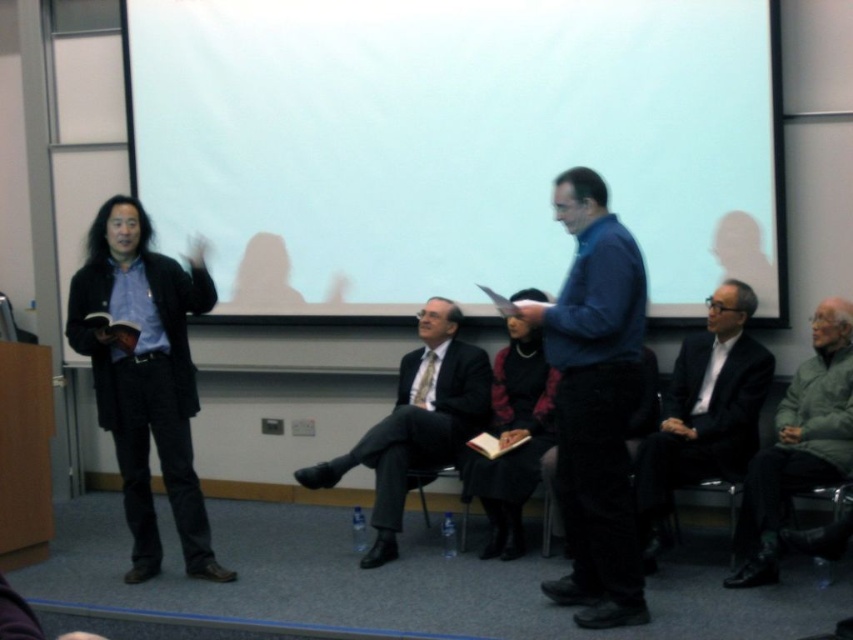
Question: Which object is the farthest from the white matte projection screen at upper center?

Choices:
 (A) blue fabric shirt at center
 (B) velvet black dress at center
 (C) dark gray suit at center
 (D) matte black suit at center

Answer: (A)

Question: Does white matte projection screen at upper center appear on the left side of blue fabric shirt at center?

Choices:
 (A) no
 (B) yes

Answer: (B)

Question: Which point is farther from the camera taking this photo?

Choices:
 (A) (770, 480)
 (B) (720, 364)

Answer: (B)

Question: Does matte black jacket at left appear on the left side of dark gray suit at center?

Choices:
 (A) no
 (B) yes

Answer: (B)

Question: Can you confirm if white matte projection screen at upper center is positioned below green wool sweater at right?

Choices:
 (A) no
 (B) yes

Answer: (A)

Question: Which point is farther from the camera taking this photo?

Choices:
 (A) (604, 541)
 (B) (161, 353)
 (C) (799, 403)
 (D) (379, 177)

Answer: (D)